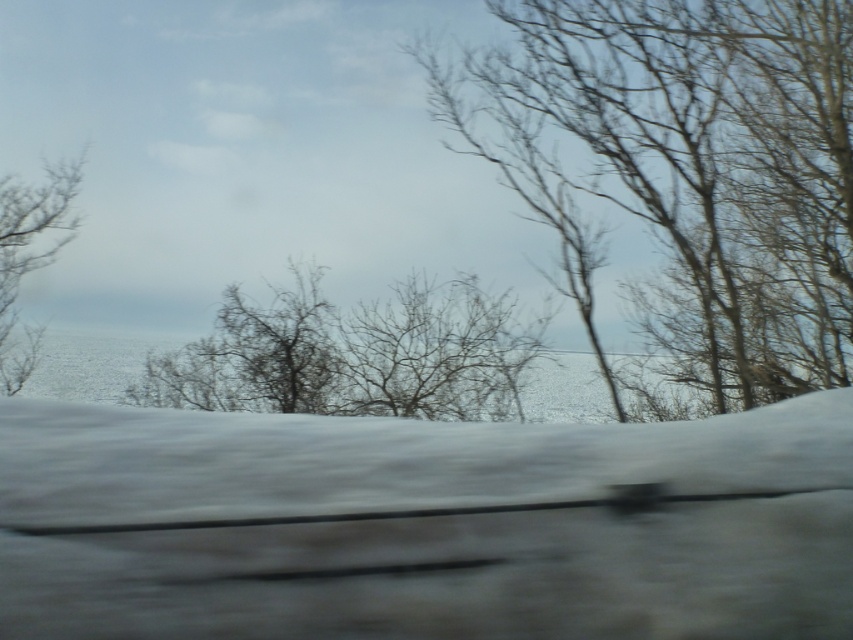
Can you confirm if bare branches at right is shorter than bare branches at center?

No, bare branches at right is not shorter than bare branches at center.

Does point (815, 156) come behind point (381, 365)?

No, (815, 156) is in front of (381, 365).

Identify the location of bare branches at right. This screenshot has height=640, width=853. (691, 164).

Does point (178, 388) come closer to viewer compared to point (13, 230)?

No.

Can you confirm if bare branches at center is taller than bare branches at left?

No, bare branches at center is not taller than bare branches at left.

Who is more forward, (228, 337) or (9, 349)?

Point (9, 349)

Where is `bare branches at center`? bare branches at center is located at coordinates (352, 355).

Who is shorter, bare branches at right or bare branches at left?

bare branches at left is shorter.

Is bare branches at right closer to the viewer compared to bare branches at left?

Yes, bare branches at right is closer to the viewer.

Does point (659, 336) come farther from viewer compared to point (51, 221)?

Yes, it is behind point (51, 221).

Find the location of `bare branches at right`. bare branches at right is located at coordinates (691, 164).